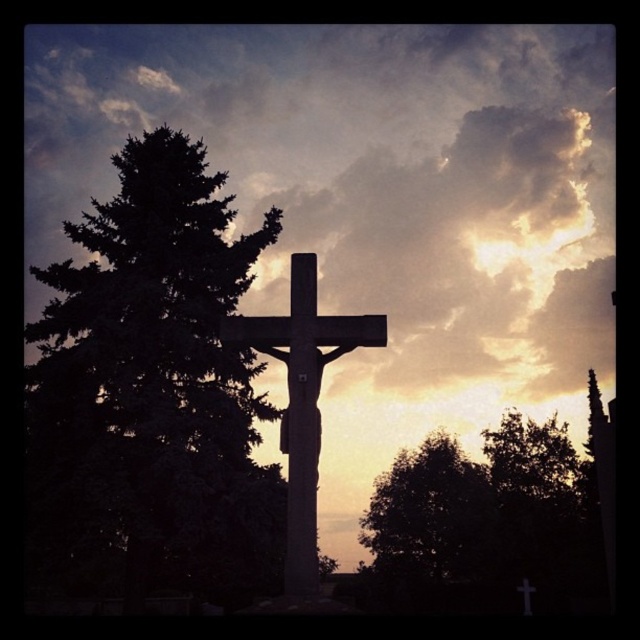
Does dark green leafy tree at lower right have a larger size compared to matte stone cross at center?

Yes, dark green leafy tree at lower right is bigger than matte stone cross at center.

Between point (378, 516) and point (292, 429), which one is positioned in front?

Point (292, 429)

Which is behind, point (468, 556) or point (230, 324)?

Point (468, 556)

The height and width of the screenshot is (640, 640). I want to click on dark green leafy tree at lower right, so 432,515.

Measure the distance between cloudy sky at upper center and camera.

The distance of cloudy sky at upper center from camera is 19.63 meters.

Find the location of a particular element. The image size is (640, 640). cloudy sky at upper center is located at coordinates (372, 179).

This screenshot has width=640, height=640. I want to click on cloudy sky at upper center, so click(x=372, y=179).

Between point (449, 497) and point (524, 580), which one is positioned behind?

Point (449, 497)

Does point (474, 500) lie behind point (522, 579)?

Yes, point (474, 500) is behind point (522, 579).

Between point (404, 486) and point (518, 586), which one is positioned behind?

The point (404, 486) is behind.

Locate an element on the screen. dark green leafy tree at lower right is located at coordinates (432, 515).